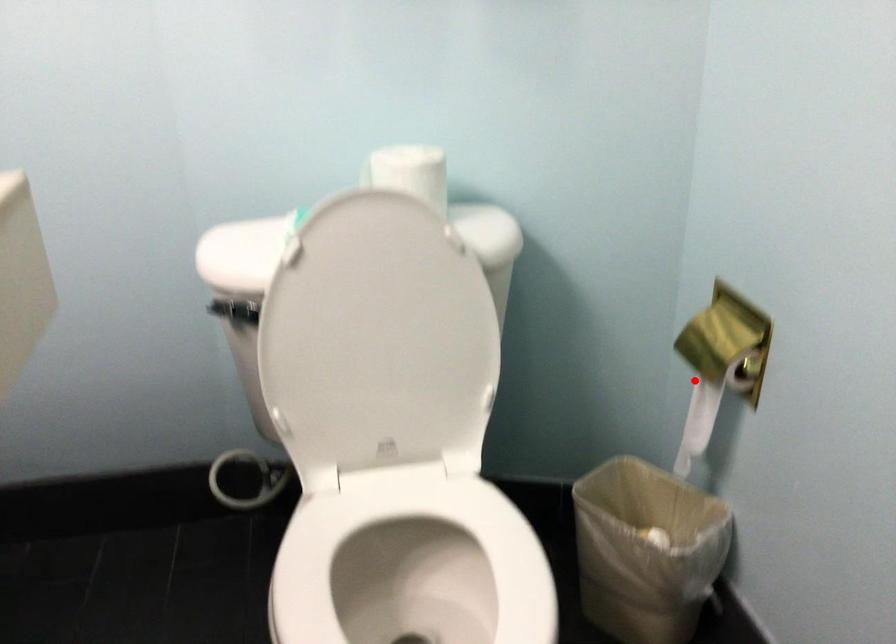
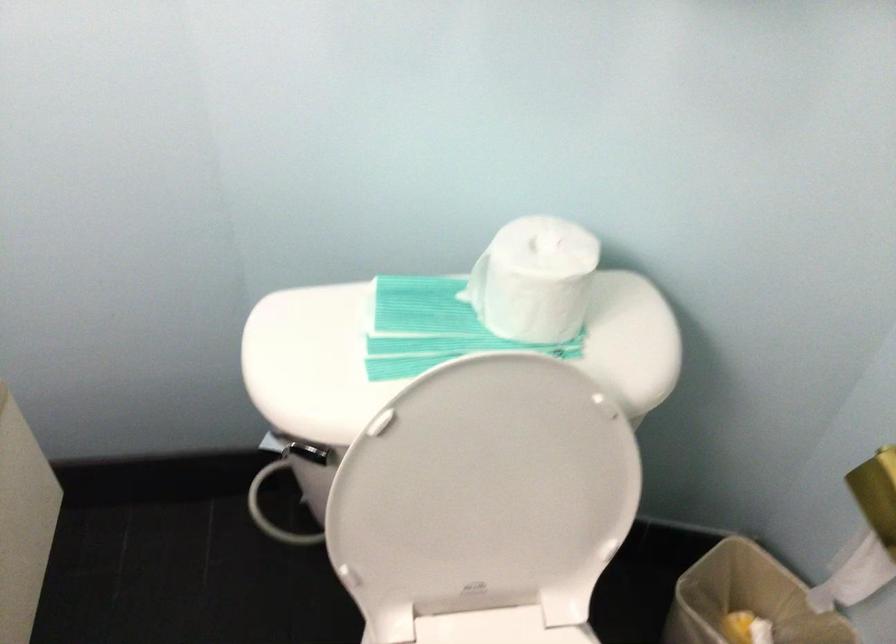
Question: I am providing you with two images of the same scene from different viewpoints. A red point is marked on the first image. Is the red point's position out of view in image 2?

Choices:
 (A) Yes
 (B) No

Answer: (B)